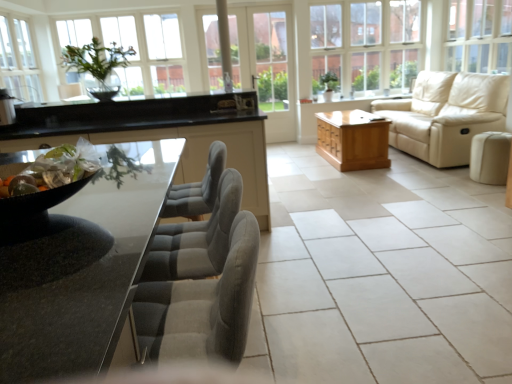
Question: Should I look upward or downward to see shiny metallic bowl at left, the 2th food positioned from the back?

Choices:
 (A) up
 (B) down

Answer: (A)

Question: Considering the relative sizes of white ceramic tile at center and clear glass window at upper center, arranged as the 2th window when viewed from the left, in the image provided, is white ceramic tile at center thinner than clear glass window at upper center, arranged as the 2th window when viewed from the left,?

Choices:
 (A) yes
 (B) no

Answer: (B)

Question: Does white ceramic tile at center appear on the right side of clear glass window at upper center, the second window positioned from the right?

Choices:
 (A) no
 (B) yes

Answer: (A)

Question: Is white ceramic tile at center bigger than clear glass window at upper center, the second window positioned from the right?

Choices:
 (A) no
 (B) yes

Answer: (A)

Question: Are white ceramic tile at center and clear glass window at upper center, the second window positioned from the right, far apart?

Choices:
 (A) no
 (B) yes

Answer: (B)

Question: Can you confirm if white ceramic tile at center is taller than clear glass window at upper center, arranged as the 2th window when viewed from the left?

Choices:
 (A) yes
 (B) no

Answer: (B)

Question: From the image's perspective, is white ceramic tile at center located beneath clear glass window at upper center, the second window positioned from the right?

Choices:
 (A) yes
 (B) no

Answer: (A)

Question: Considering the relative sizes of beige fabric bar stool at right and clear glass vase at upper center, marked as the first window in a left-to-right arrangement, in the image provided, is beige fabric bar stool at right bigger than clear glass vase at upper center, marked as the first window in a left-to-right arrangement,?

Choices:
 (A) yes
 (B) no

Answer: (B)

Question: Is beige fabric bar stool at right oriented towards clear glass vase at upper center, marked as the first window in a left-to-right arrangement?

Choices:
 (A) no
 (B) yes

Answer: (A)

Question: Is beige fabric bar stool at right located outside clear glass vase at upper center, marked as the first window in a left-to-right arrangement?

Choices:
 (A) no
 (B) yes

Answer: (B)

Question: Is beige fabric bar stool at right closer to camera compared to clear glass vase at upper center, marked as the first window in a left-to-right arrangement?

Choices:
 (A) no
 (B) yes

Answer: (B)

Question: From the image's perspective, is beige fabric bar stool at right below clear glass vase at upper center, marked as the first window in a left-to-right arrangement?

Choices:
 (A) yes
 (B) no

Answer: (A)

Question: Is beige fabric bar stool at right further to the viewer compared to clear glass vase at upper center, marked as the first window in a left-to-right arrangement?

Choices:
 (A) yes
 (B) no

Answer: (B)

Question: Are beige leather couch at right and clear glass window at upper center, arranged as the 2th window when viewed from the left, making contact?

Choices:
 (A) yes
 (B) no

Answer: (B)